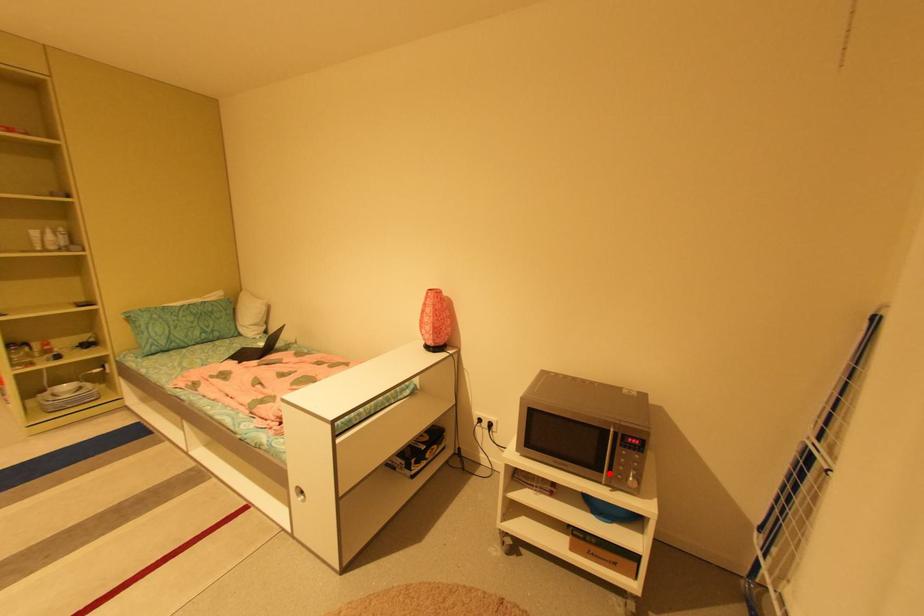
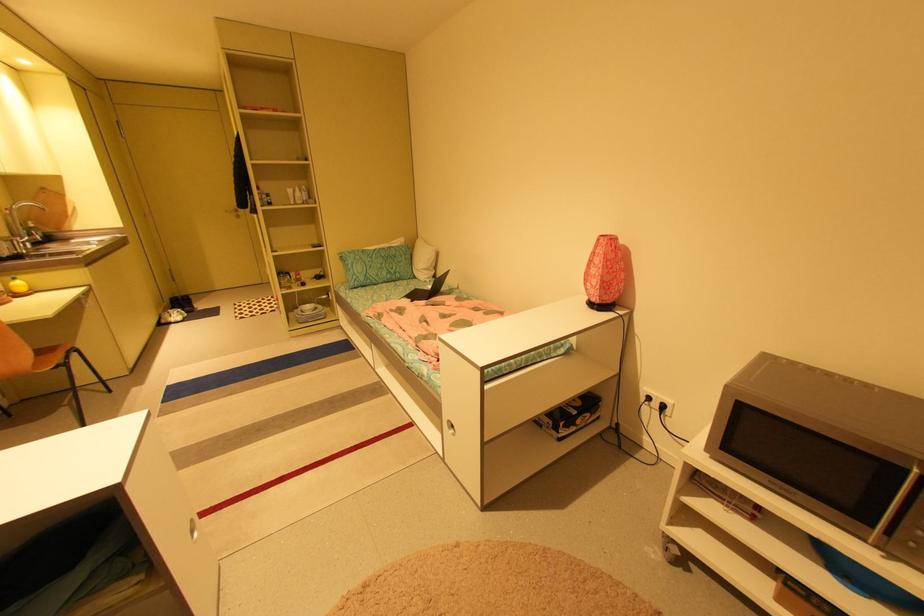
Question: A red point is marked in image1. In image2, is the corresponding 3D point closer to the camera or farther? Reply with the corresponding letter.

Choices:
 (A) The corresponding 3D point is closer.
 (B) The corresponding 3D point is farther.

Answer: (A)